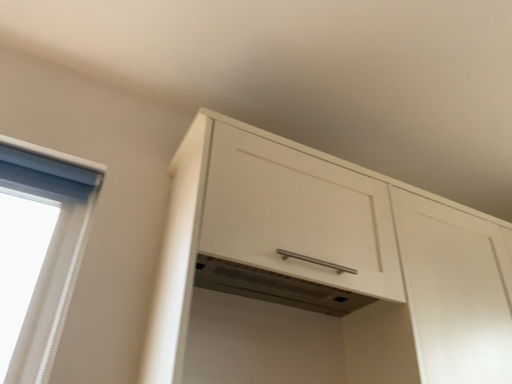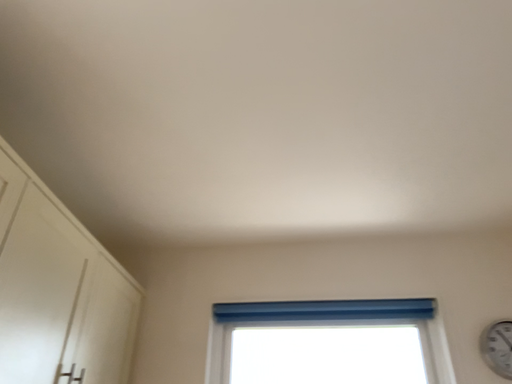
Question: Which way did the camera rotate in the video?

Choices:
 (A) rotated upward
 (B) rotated downward

Answer: (B)